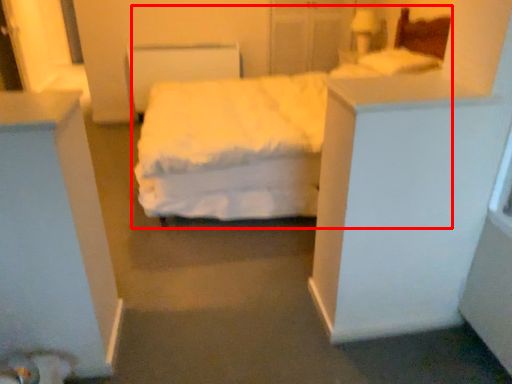
Question: Considering the relative positions of bed (annotated by the red box) and pillow in the image provided, where is bed (annotated by the red box) located with respect to the staircase?

Choices:
 (A) right
 (B) left

Answer: (B)